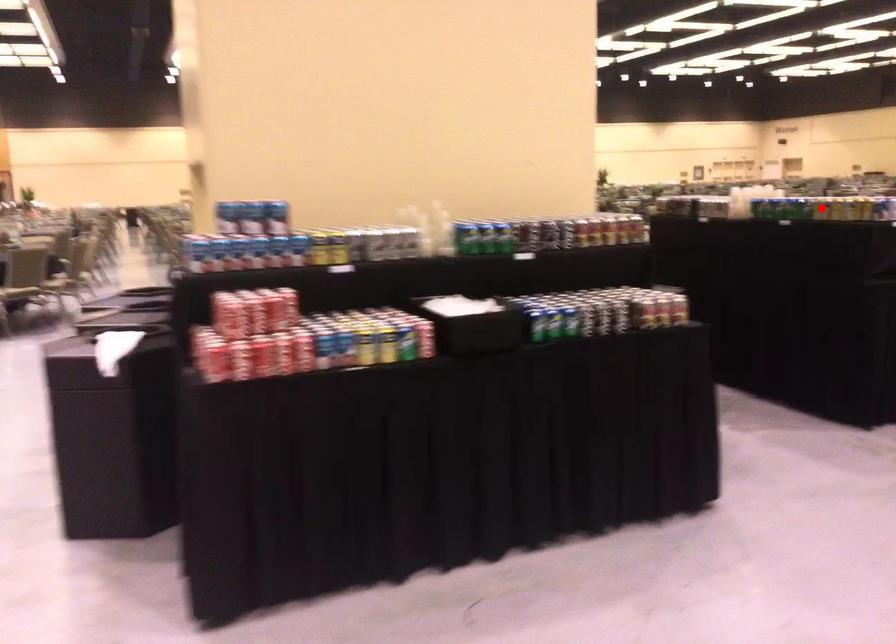
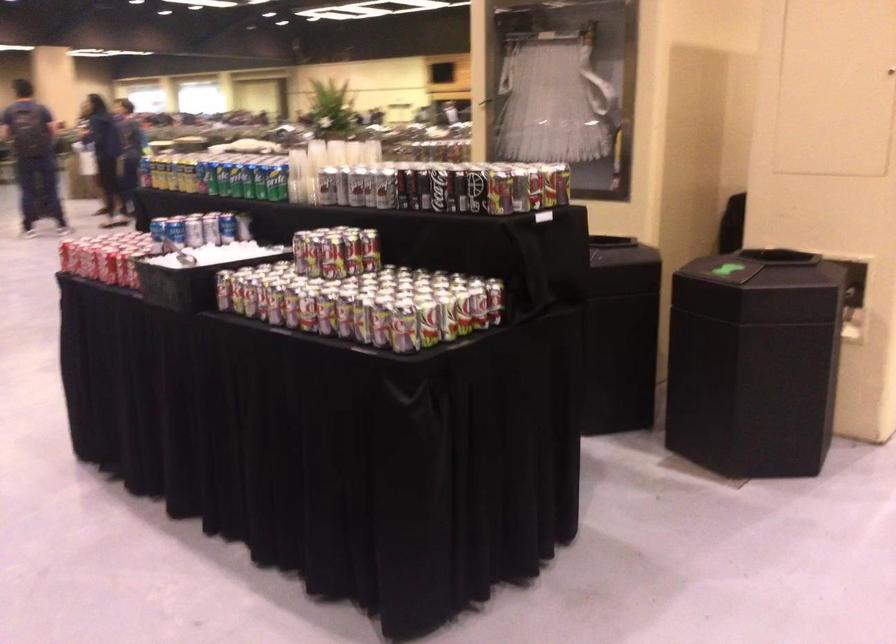
Question: I am providing you with two images of the same scene from different viewpoints. A red point is marked on the first image. Can you still see the location of the red point in image 2?

Choices:
 (A) Yes
 (B) No

Answer: (B)